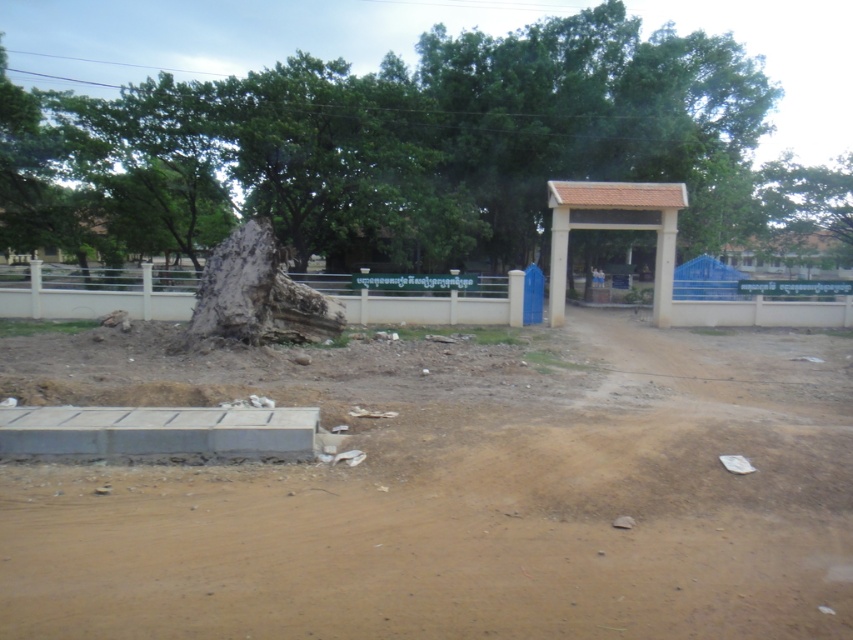
Question: Can you confirm if brown sandy dirt at lower left is wider than green leafy tree at center?

Choices:
 (A) yes
 (B) no

Answer: (B)

Question: Which object appears farthest from the camera in this image?

Choices:
 (A) brown sandy dirt at lower left
 (B) rough bark stump at center
 (C) green leafy tree at center

Answer: (C)

Question: Where is brown sandy dirt at lower left located in relation to rough bark stump at center in the image?

Choices:
 (A) left
 (B) right

Answer: (B)

Question: Which object is positioned farthest from the green leafy tree at center?

Choices:
 (A) rough bark stump at center
 (B) brown sandy dirt at lower left

Answer: (A)

Question: Which object appears farthest from the camera in this image?

Choices:
 (A) green leafy tree at center
 (B) brown sandy dirt at lower left

Answer: (A)

Question: Is brown sandy dirt at lower left closer to camera compared to rough bark stump at center?

Choices:
 (A) no
 (B) yes

Answer: (B)